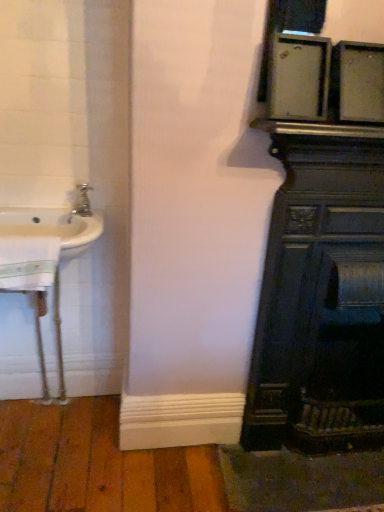
The width and height of the screenshot is (384, 512). I want to click on vacant space positioned to the left of brushed metal faucet at left, so click(46, 209).